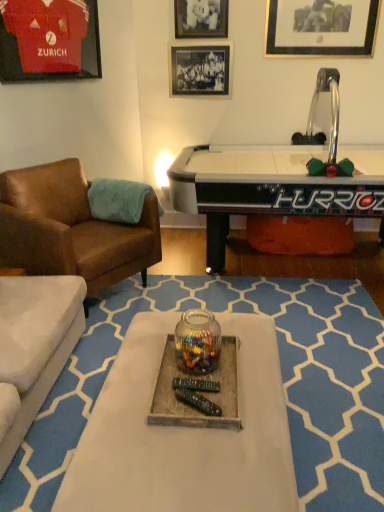
Find the location of a particular element. Image resolution: width=384 pixels, height=512 pixels. vacant area that lies to the right of translucent glass jar at center is located at coordinates (230, 362).